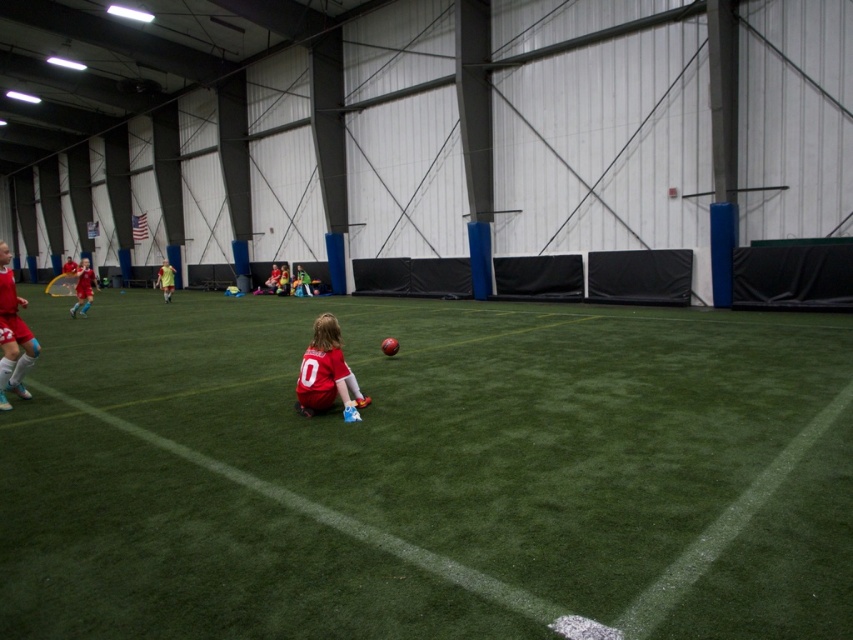
You are a soccer coach observing the indoor field. You need to place a 2 meter wide equipment rack on the green artificial turf at center. Can the equipment rack fit on the matte red jersey at center?

The green artificial turf at center might be wider than matte red jersey at center, so the equipment rack should be placed on the green artificial turf at center instead of the jersey since the jersey is likely too small.

You are standing at the entrance of the indoor soccer field and want to place a new goalpost at the exact center of the green artificial turf at center. According to the coordinates provided, where should you position the goalpost?

The green artificial turf at center is located at point (425, 472), so you should position the goalpost at those coordinates to place it exactly at the center of the green artificial turf at center.

You are a soccer coach observing the indoor field. You notice the green artificial turf at center and the matte red jersey at center. Which object is located below the other?

The green artificial turf at center is positioned under matte red jersey at center, so the jersey is above the turf.